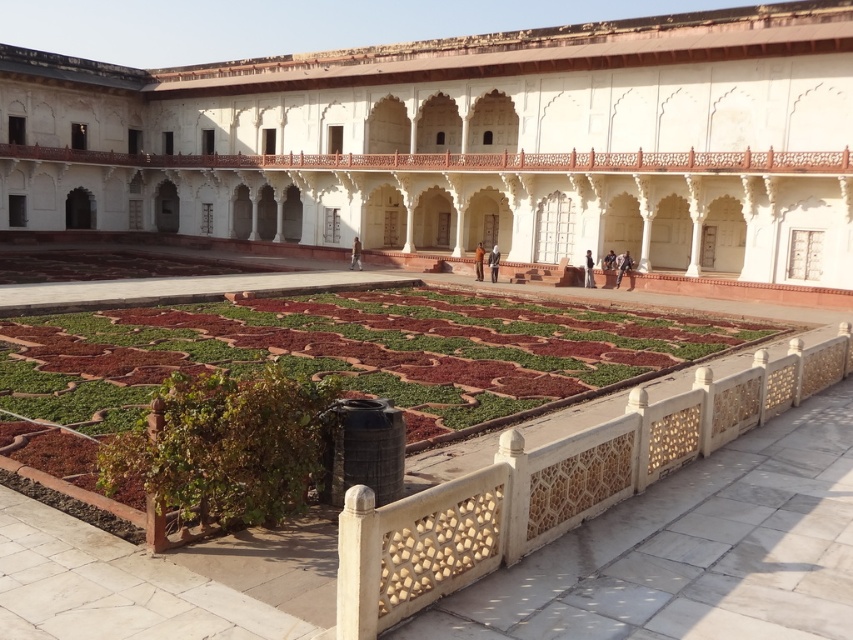
Does green leafy plant at center come in front of dark blue jeans at center?

Yes, green leafy plant at center is in front of dark blue jeans at center.

Who is more forward, (231, 429) or (605, 266)?

Positioned in front is point (231, 429).

At what (x,y) coordinates should I click in order to perform the action: click on green leafy plant at center. Please return your answer as a coordinate pair (x, y). This screenshot has width=853, height=640. Looking at the image, I should click on (225, 445).

Can you confirm if green textured garden at center is taller than dark blue fabric at center?

Yes, green textured garden at center is taller than dark blue fabric at center.

What do you see at coordinates (334, 356) in the screenshot? Image resolution: width=853 pixels, height=640 pixels. I see `green textured garden at center` at bounding box center [334, 356].

This screenshot has height=640, width=853. I want to click on green textured garden at center, so click(334, 356).

Locate an element on the screen. The image size is (853, 640). green textured garden at center is located at coordinates (334, 356).

Is light brown fabric at center closer to camera compared to dark blue fabric at center?

No, light brown fabric at center is behind dark blue fabric at center.

Between light brown fabric at center and dark blue fabric at center, which one has less height?

light brown fabric at center

Locate an element on the screen. The image size is (853, 640). light brown fabric at center is located at coordinates (492, 262).